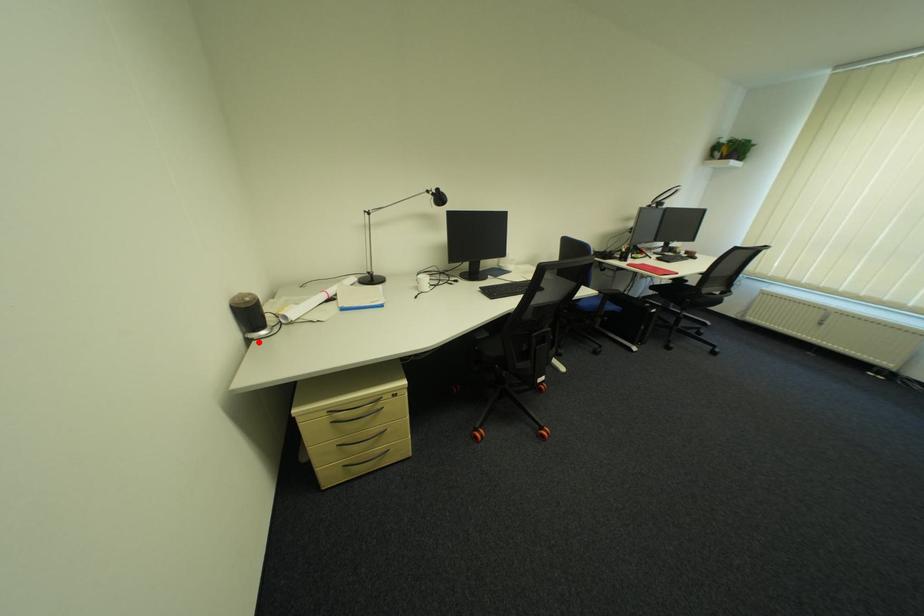
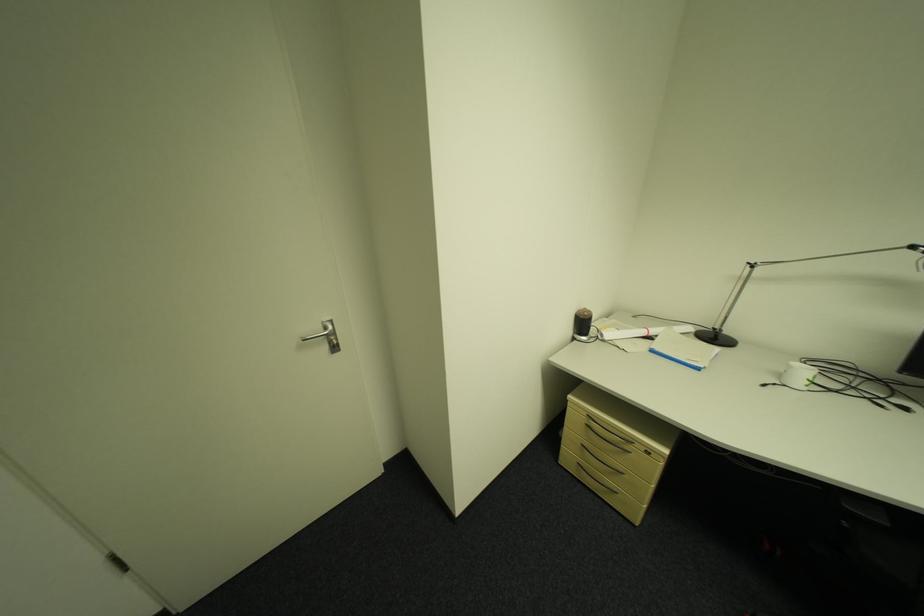
The point at the highlighted location is marked in the first image. Where is the corresponding point in the second image?

(582, 339)